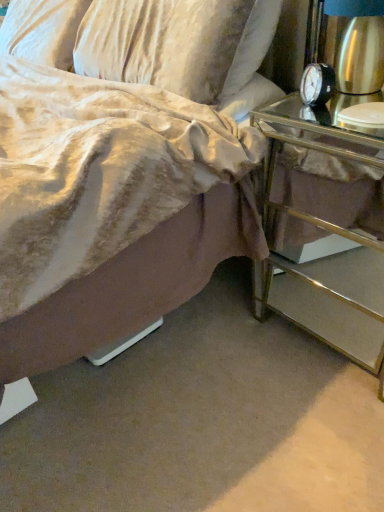
Question: Is metallic mirrored nightstand at right wider or thinner than black metal/aluminum alarm clock at upper right?

Choices:
 (A) thin
 (B) wide

Answer: (B)

Question: In the image, is metallic mirrored nightstand at right on the left side or the right side of black metal/aluminum alarm clock at upper right?

Choices:
 (A) left
 (B) right

Answer: (B)

Question: Is metallic mirrored nightstand at right in front of or behind black metal/aluminum alarm clock at upper right in the image?

Choices:
 (A) behind
 (B) front

Answer: (B)

Question: Looking at the image, does black metal/aluminum alarm clock at upper right seem bigger or smaller compared to metallic mirrored nightstand at right?

Choices:
 (A) big
 (B) small

Answer: (B)

Question: From a real-world perspective, is black metal/aluminum alarm clock at upper right positioned above or below metallic mirrored nightstand at right?

Choices:
 (A) above
 (B) below

Answer: (A)

Question: Considering the positions of black metal/aluminum alarm clock at upper right and metallic mirrored nightstand at right in the image, is black metal/aluminum alarm clock at upper right taller or shorter than metallic mirrored nightstand at right?

Choices:
 (A) short
 (B) tall

Answer: (A)

Question: Which is correct: black metal/aluminum alarm clock at upper right is inside metallic mirrored nightstand at right, or outside of it?

Choices:
 (A) inside
 (B) outside

Answer: (B)